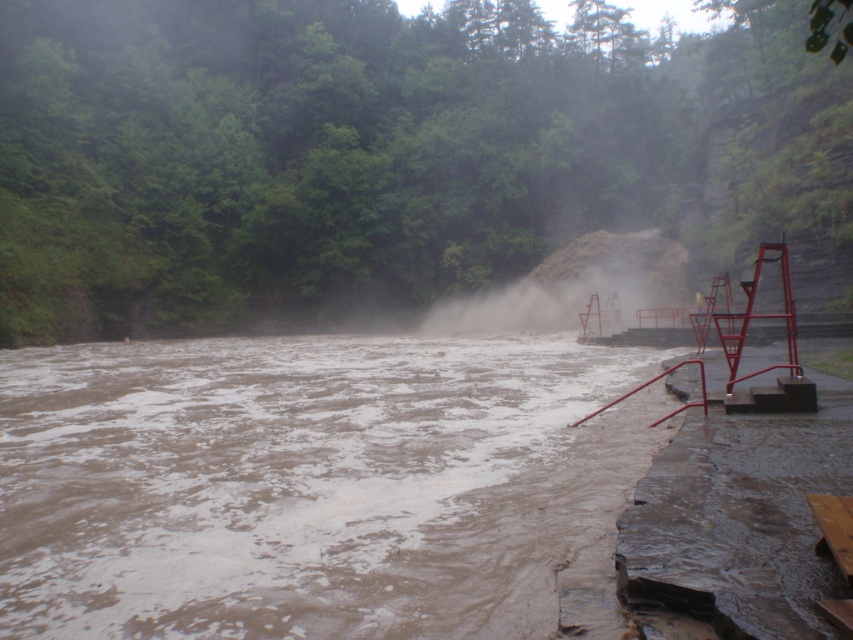
You are standing on the embankment with red metal railings and steps. You need to reach the muddy water at lower left. Which direction should you move to get closer to it?

To reach the muddy water at lower left, you should move towards the lower left direction since it is located at point [309,483].

You are a hiker trying to cross the flooded area. You see the muddy water at lower left and the white dusty steam at center. Which path has a lower water level to cross safely?

The muddy water at lower left has a lesser height compared to the white dusty steam at center, so the muddy water at lower left has a lower water level and is safer to cross.

Looking at this image, you are standing on the concrete embankment with red metal railings on the right side of the image. You want to cross to the point marked as point (309, 483) on the muddy water at lower left. Given that the water is turbulent with strong currents, would you recommend attempting this crossing?

The point (309, 483) is on muddy water at lower left, which is described as having turbulent water with strong currents. Due to the dangerous conditions, it is not recommended to attempt the crossing.